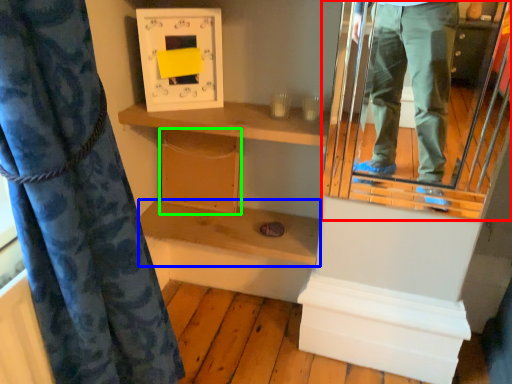
Question: Which object is positioned farthest from mirror (highlighted by a red box)? Select from shelf (highlighted by a blue box) and cabinet (highlighted by a green box).

Choices:
 (A) shelf
 (B) cabinet

Answer: (B)